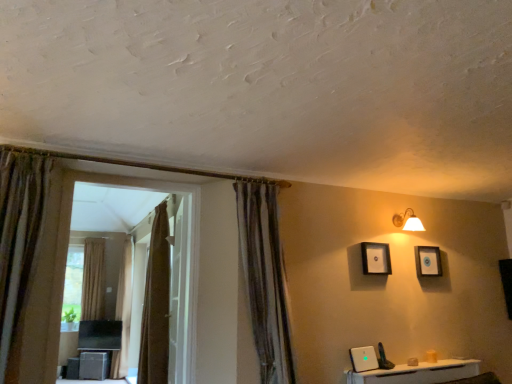
Question: Is white glossy door at center at the left side of brown textured curtain at left, which ranks as the 3th curtain in right-to-left order?

Choices:
 (A) no
 (B) yes

Answer: (A)

Question: Is white glossy door at center outside brown textured curtain at left, the second curtain in the left-to-right sequence?

Choices:
 (A) no
 (B) yes

Answer: (B)

Question: Can you confirm if white glossy door at center is bigger than brown textured curtain at left, which ranks as the 3th curtain in right-to-left order?

Choices:
 (A) no
 (B) yes

Answer: (A)

Question: Is white glossy door at center behind brown textured curtain at left, which ranks as the 3th curtain in right-to-left order?

Choices:
 (A) yes
 (B) no

Answer: (B)

Question: Is white glossy door at center positioned with its back to brown textured curtain at left, the second curtain in the left-to-right sequence?

Choices:
 (A) yes
 (B) no

Answer: (B)

Question: From the image's perspective, is white glossy door at center below brown textured curtain at left, which ranks as the 3th curtain in right-to-left order?

Choices:
 (A) no
 (B) yes

Answer: (A)

Question: Considering the relative sizes of white glossy door at center and matte wooden picture frame at upper right, the 2th picture frame viewed from the front, in the image provided, is white glossy door at center smaller than matte wooden picture frame at upper right, the 2th picture frame viewed from the front,?

Choices:
 (A) yes
 (B) no

Answer: (B)

Question: Considering the relative sizes of white glossy door at center and matte wooden picture frame at upper right, the 1th picture frame from the right, in the image provided, is white glossy door at center wider than matte wooden picture frame at upper right, the 1th picture frame from the right,?

Choices:
 (A) no
 (B) yes

Answer: (B)

Question: Does white glossy door at center come behind matte wooden picture frame at upper right, the 1th picture frame from the right?

Choices:
 (A) no
 (B) yes

Answer: (A)

Question: Does white glossy door at center have a lesser height compared to matte wooden picture frame at upper right, which ranks as the 2th picture frame in left-to-right order?

Choices:
 (A) yes
 (B) no

Answer: (B)

Question: Is white glossy door at center bigger than matte wooden picture frame at upper right, the 1th picture frame from the right?

Choices:
 (A) no
 (B) yes

Answer: (B)

Question: Is white glossy door at center facing towards matte wooden picture frame at upper right, the 1th picture frame from the right?

Choices:
 (A) yes
 (B) no

Answer: (B)

Question: From a real-world perspective, does matte black picture frame at upper center, acting as the 2th picture frame starting from the right, stand above white glossy door at center?

Choices:
 (A) yes
 (B) no

Answer: (A)